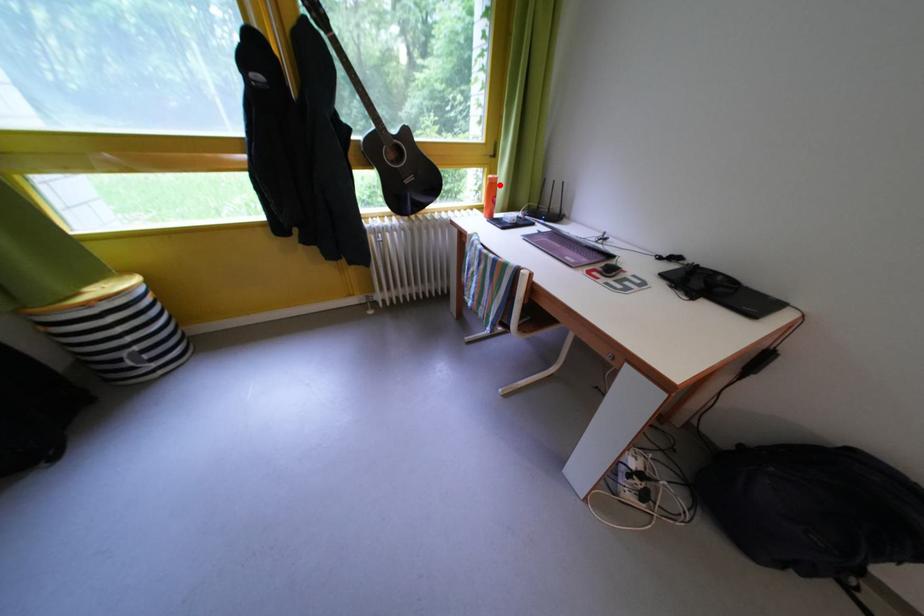
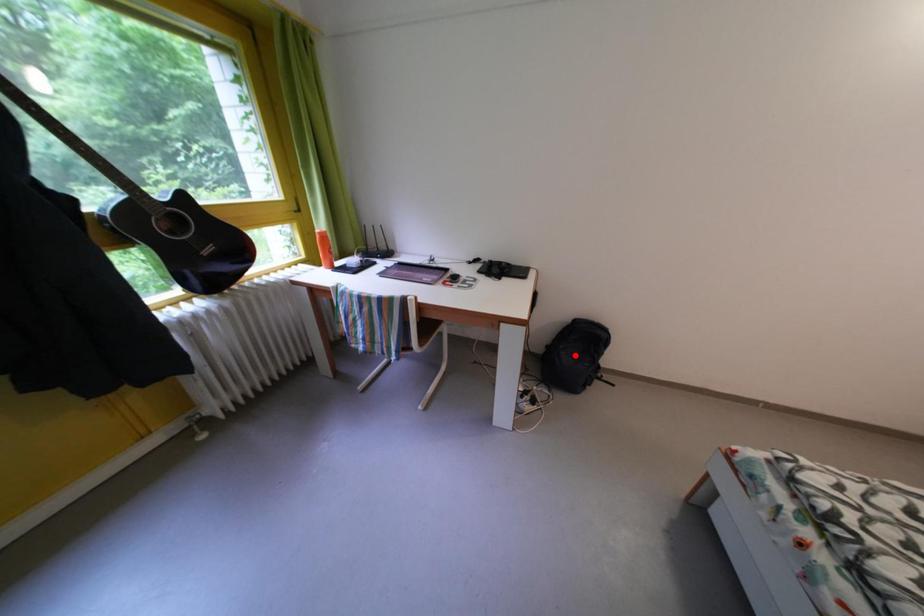
I am providing you with two images of the same scene from different viewpoints. A red point is marked on the first image and another point is marked on the second image. Is the marked point in image1 the same physical position as the marked point in image2?

No